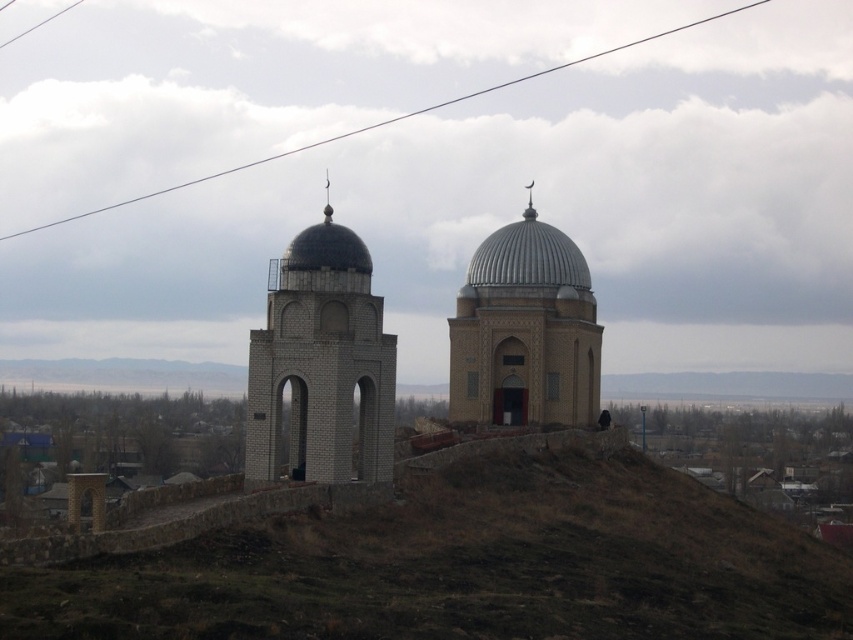
Question: Does metallic ribbed dome at center have a lesser width compared to black wire at upper center?

Choices:
 (A) yes
 (B) no

Answer: (A)

Question: Which of the following is the farthest from the observer?

Choices:
 (A) matte white dome at center
 (B) black wire at upper center
 (C) white brick bell tower at center

Answer: (B)

Question: Is brown grassy hillside at center below metallic ribbed dome at center?

Choices:
 (A) yes
 (B) no

Answer: (A)

Question: Which object appears closest to the camera in this image?

Choices:
 (A) black wire at upper center
 (B) metallic ribbed dome at center
 (C) silver metallic dome at center
 (D) brown grassy hillside at center

Answer: (D)

Question: Which point is closer to the camera?

Choices:
 (A) metallic ribbed dome at center
 (B) black wire at upper center

Answer: (A)

Question: Is metallic ribbed dome at center below black wire at upper center?

Choices:
 (A) no
 (B) yes

Answer: (B)